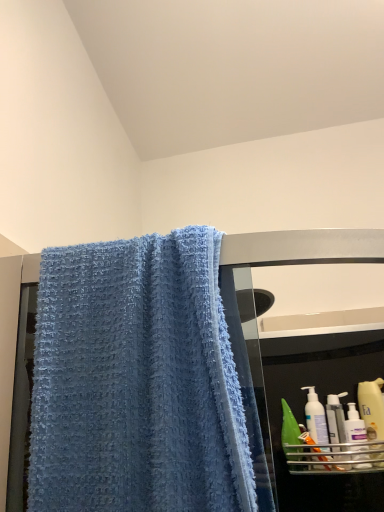
Question: Considering the relative positions of blue textured towel at upper left and white plastic pump bottle at right, acting as the 1th cleaning product starting from the left, in the image provided, is blue textured towel at upper left to the left or to the right of white plastic pump bottle at right, acting as the 1th cleaning product starting from the left,?

Choices:
 (A) left
 (B) right

Answer: (A)

Question: Choose the correct answer: Is blue textured towel at upper left inside white plastic pump bottle at right, acting as the 1th cleaning product starting from the left, or outside it?

Choices:
 (A) inside
 (B) outside

Answer: (B)

Question: Which is nearer to the white plastic bottle at right, arranged as the second mouthwash when viewed from the left?

Choices:
 (A) translucent plastic bottle at right, which is the 3th cleaning product in left-to-right order
 (B) white plastic pump bottle at right, acting as the 1th cleaning product starting from the left
 (C) green matte bottle at right, which is the 2th mouthwash in right-to-left order
 (D) blue textured towel at upper left
 (E) white plastic bottle at lower right, the second cleaning product when ordered from right to left

Answer: (E)

Question: Estimate the real-world distances between objects in this image. Which object is closer to the white plastic pump bottle at right, arranged as the third cleaning product when viewed from the right?

Choices:
 (A) green matte bottle at right, the first mouthwash when ordered from left to right
 (B) white plastic bottle at right, arranged as the second mouthwash when viewed from the left
 (C) white plastic bottle at lower right, marked as the second cleaning product in a left-to-right arrangement
 (D) blue textured towel at upper left
 (E) translucent plastic bottle at right, which is the 3th cleaning product in left-to-right order

Answer: (B)